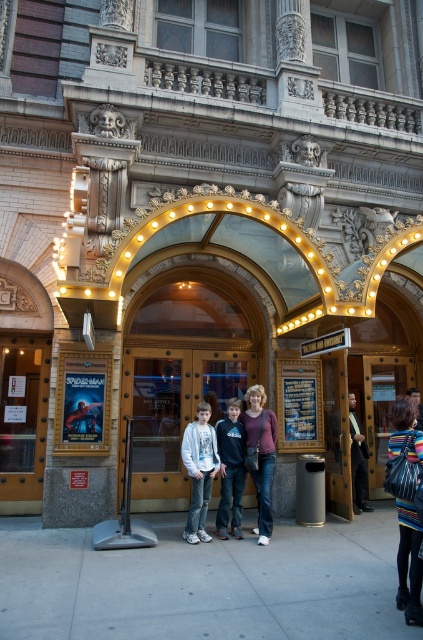
Question: Is denim jeans at center wider than light gray hoodie at center?

Choices:
 (A) no
 (B) yes

Answer: (B)

Question: Among these points, which one is farthest from the camera?

Choices:
 (A) (390, 608)
 (B) (302, 444)
 (C) (206, 536)

Answer: (B)

Question: Can you confirm if wooden door at center is positioned to the left of dark blue hoodie at center?

Choices:
 (A) no
 (B) yes

Answer: (B)

Question: Is gray concrete sidewalk at lower center behind wooden door at left?

Choices:
 (A) no
 (B) yes

Answer: (A)

Question: Which point is closer to the camera taking this photo?

Choices:
 (A) (5, 476)
 (B) (312, 444)
 (C) (239, 570)

Answer: (C)

Question: Estimate the real-world distances between objects in this image. Which object is farther from the gray concrete sidewalk at lower center?

Choices:
 (A) striped sweater at center
 (B) denim jeans at center

Answer: (B)